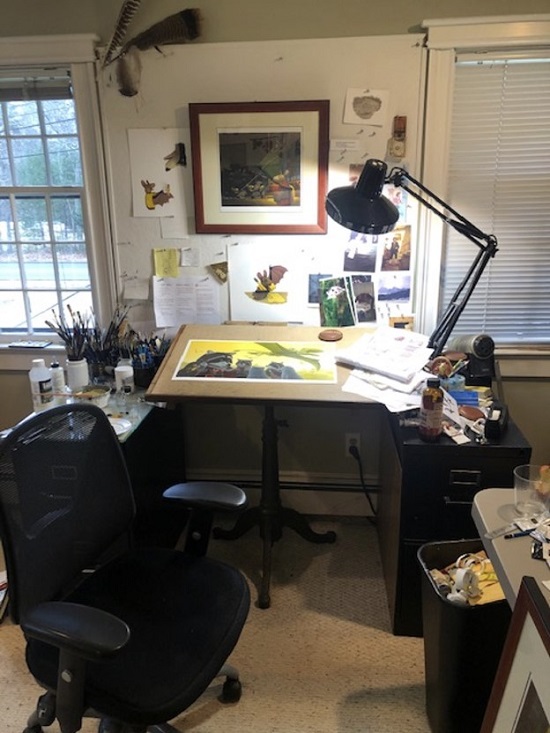
Identify the location of desk, wood. (298, 402).